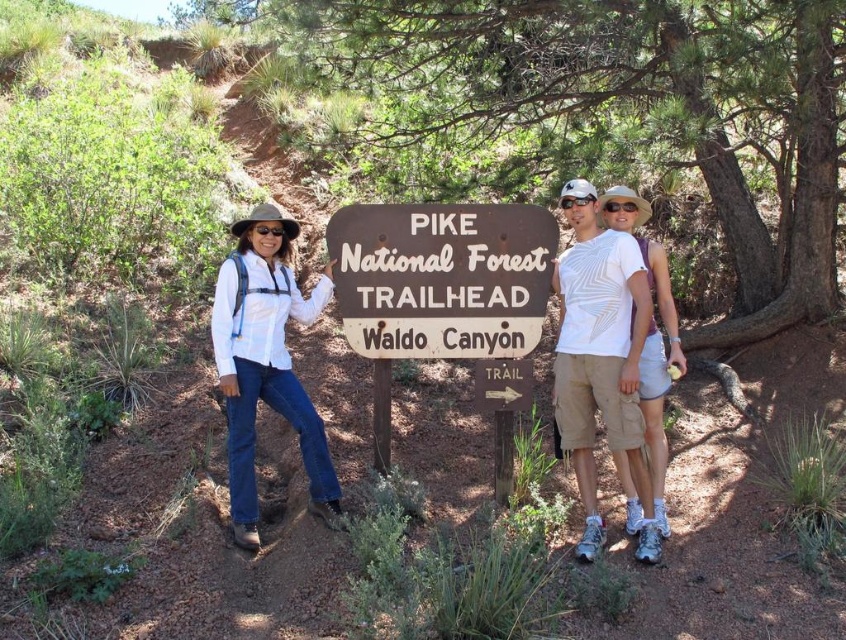
Question: Does white textured shirt at center appear over white matte shirt at center?

Choices:
 (A) no
 (B) yes

Answer: (B)

Question: Which of the following is the closest to the observer?

Choices:
 (A) (226, 387)
 (B) (586, 355)

Answer: (A)

Question: Does white textured shirt at center have a larger size compared to white matte shirt at center?

Choices:
 (A) no
 (B) yes

Answer: (A)

Question: Which object appears farthest from the camera in this image?

Choices:
 (A) white textured shirt at center
 (B) brown wooden sign at center

Answer: (B)

Question: Which of the following is the closest to the observer?

Choices:
 (A) brown wooden sign at center
 (B) white matte shirt at center
 (C) white textured shirt at center

Answer: (C)

Question: Does brown wooden sign at center appear on the left side of white matte shirt at center?

Choices:
 (A) no
 (B) yes

Answer: (A)